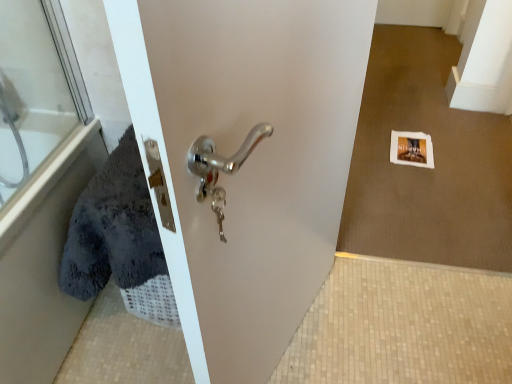
Question: Considering the positions of soft gray towel at left and transparent glass door at upper left in the image, is soft gray towel at left taller or shorter than transparent glass door at upper left?

Choices:
 (A) short
 (B) tall

Answer: (B)

Question: Considering the positions of soft gray towel at left and transparent glass door at upper left in the image, is soft gray towel at left wider or thinner than transparent glass door at upper left?

Choices:
 (A) thin
 (B) wide

Answer: (B)

Question: From the image's perspective, is soft gray towel at left located above or below transparent glass door at upper left?

Choices:
 (A) below
 (B) above

Answer: (A)

Question: Choose the correct answer: Is transparent glass door at upper left inside soft gray towel at left or outside it?

Choices:
 (A) inside
 (B) outside

Answer: (A)

Question: In the image, is transparent glass door at upper left positioned in front of or behind soft gray towel at left?

Choices:
 (A) behind
 (B) front

Answer: (A)

Question: From a real-world perspective, is transparent glass door at upper left positioned above or below soft gray towel at left?

Choices:
 (A) below
 (B) above

Answer: (B)

Question: In terms of size, does transparent glass door at upper left appear bigger or smaller than soft gray towel at left?

Choices:
 (A) big
 (B) small

Answer: (B)